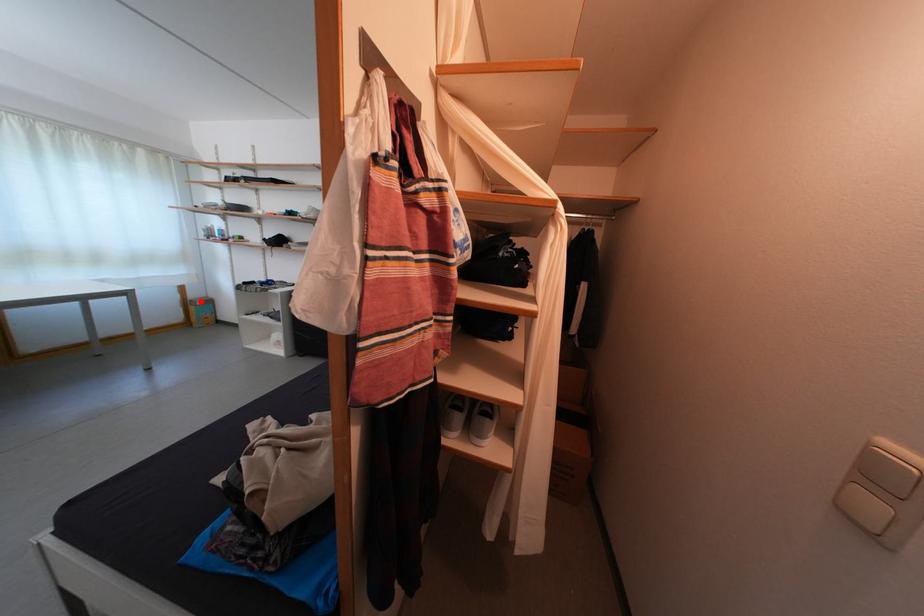
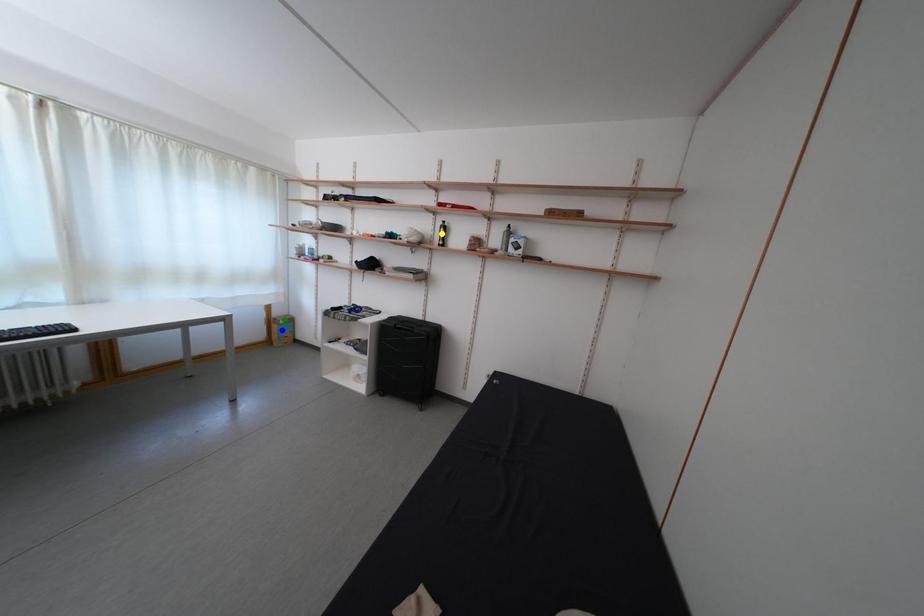
Question: I am providing you with two images of the same scene from different viewpoints. A red point is marked on the first image. You are given multiple points on the second image. Can you choose the point in image 2 that corresponds to the point in image 1?

Choices:
 (A) green point
 (B) yellow point
 (C) blue point

Answer: (A)